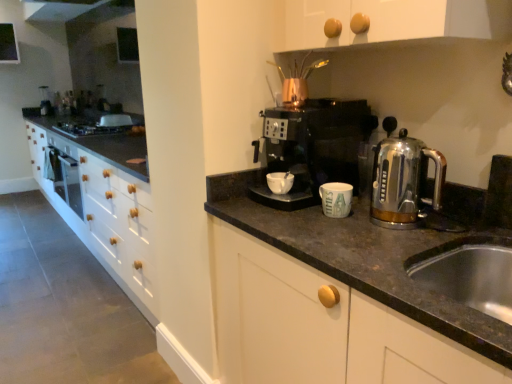
Question: Are white matte mug at center and satin chrome kettle at right beside each other?

Choices:
 (A) no
 (B) yes

Answer: (A)

Question: Can you confirm if white matte mug at center is taller than satin chrome kettle at right?

Choices:
 (A) yes
 (B) no

Answer: (B)

Question: Can you confirm if white matte mug at center is smaller than satin chrome kettle at right?

Choices:
 (A) no
 (B) yes

Answer: (B)

Question: From a real-world perspective, is white matte mug at center physically above satin chrome kettle at right?

Choices:
 (A) no
 (B) yes

Answer: (A)

Question: Can we say white matte mug at center lies outside satin chrome kettle at right?

Choices:
 (A) yes
 (B) no

Answer: (A)

Question: From the image's perspective, does white matte mug at center appear lower than satin chrome kettle at right?

Choices:
 (A) no
 (B) yes

Answer: (B)

Question: Is the position of brushed metal coffee machine at upper center more distant than that of black plastic coffee maker at center?

Choices:
 (A) no
 (B) yes

Answer: (B)

Question: Does brushed metal coffee machine at upper center turn towards black plastic coffee maker at center?

Choices:
 (A) yes
 (B) no

Answer: (B)

Question: Is brushed metal coffee machine at upper center turned away from black plastic coffee maker at center?

Choices:
 (A) no
 (B) yes

Answer: (A)

Question: Is black plastic coffee maker at center surrounded by brushed metal coffee machine at upper center?

Choices:
 (A) no
 (B) yes

Answer: (A)

Question: Is the position of brushed metal coffee machine at upper center less distant than that of black plastic coffee maker at center?

Choices:
 (A) no
 (B) yes

Answer: (A)

Question: Can you confirm if brushed metal coffee machine at upper center is thinner than black plastic coffee maker at center?

Choices:
 (A) yes
 (B) no

Answer: (A)

Question: From the image's perspective, is black plastic coffee maker at center below matte ceramic mug at center?

Choices:
 (A) no
 (B) yes

Answer: (A)